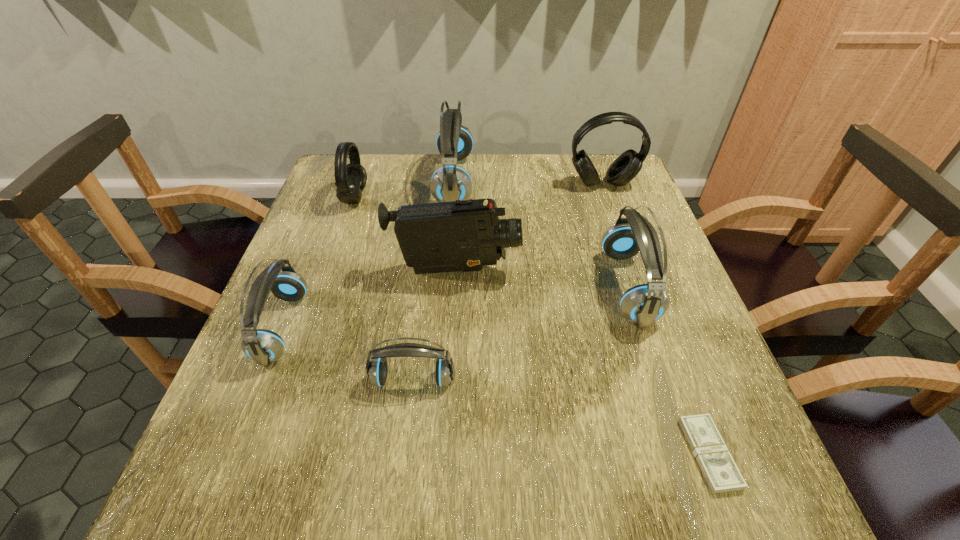
Locate an element on the screen. vacant space at the near right corner is located at coordinates (708, 508).

Image resolution: width=960 pixels, height=540 pixels. I want to click on unoccupied position between the smaller gray headset and the farthest blue headset, so click(404, 189).

The image size is (960, 540). In order to click on free space between the second biggest blue headset and the nearest object in this screenshot , I will do `click(668, 370)`.

Image resolution: width=960 pixels, height=540 pixels. I want to click on empty space that is in between the leftmost blue headset and the smallest blue headset, so click(348, 353).

The height and width of the screenshot is (540, 960). I want to click on empty space between the farthest blue headset and the right gray headset, so click(x=528, y=183).

Identify the location of free spot between the leftmost blue headset and the third smallest blue headset. (455, 307).

Where is `unoccupied area between the shortest headset and the left gray headset`? The width and height of the screenshot is (960, 540). unoccupied area between the shortest headset and the left gray headset is located at coordinates (384, 288).

Locate an element on the screen. This screenshot has height=540, width=960. empty space that is in between the second shortest object and the rightmost blue headset is located at coordinates (520, 333).

I want to click on empty location between the nearest object and the rightmost blue headset, so click(x=668, y=370).

Image resolution: width=960 pixels, height=540 pixels. In order to click on object that is the seventh closest to the second smallest blue headset in this screenshot , I will do `click(625, 167)`.